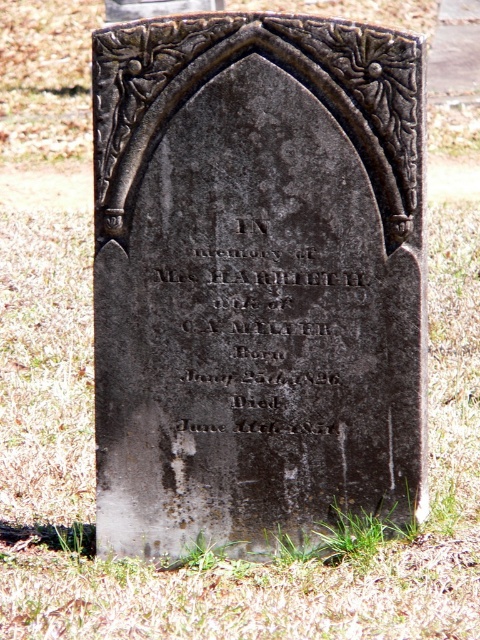
Does gray stone gravestone at center come behind green grass at center?

Yes, it is.

Is point (300, 321) in front of point (420, 540)?

That is True.

Locate an element on the screen. gray stone gravestone at center is located at coordinates (255, 278).

This screenshot has height=640, width=480. I want to click on gray stone gravestone at center, so click(x=255, y=278).

Is gray stone gravestone at center further to camera compared to black stone inscription at center?

No, gray stone gravestone at center is closer to the viewer.

Who is taller, gray stone gravestone at center or black stone inscription at center?

gray stone gravestone at center is taller.

The image size is (480, 640). What do you see at coordinates (255, 278) in the screenshot? I see `gray stone gravestone at center` at bounding box center [255, 278].

In order to click on gray stone gravestone at center in this screenshot , I will do `click(255, 278)`.

Is green grass at center behind black stone inscription at center?

No.

Who is shorter, green grass at center or black stone inscription at center?

Standing shorter between the two is black stone inscription at center.

Which is in front, point (81, 618) or point (376, 241)?

Positioned in front is point (81, 618).

I want to click on green grass at center, so click(206, 556).